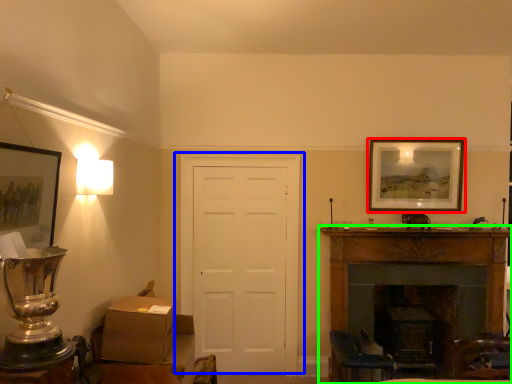
Question: Considering the real-world distances, which object is farthest from picture frame (highlighted by a red box)? door (highlighted by a blue box) or fireplace (highlighted by a green box)?

Choices:
 (A) door
 (B) fireplace

Answer: (A)